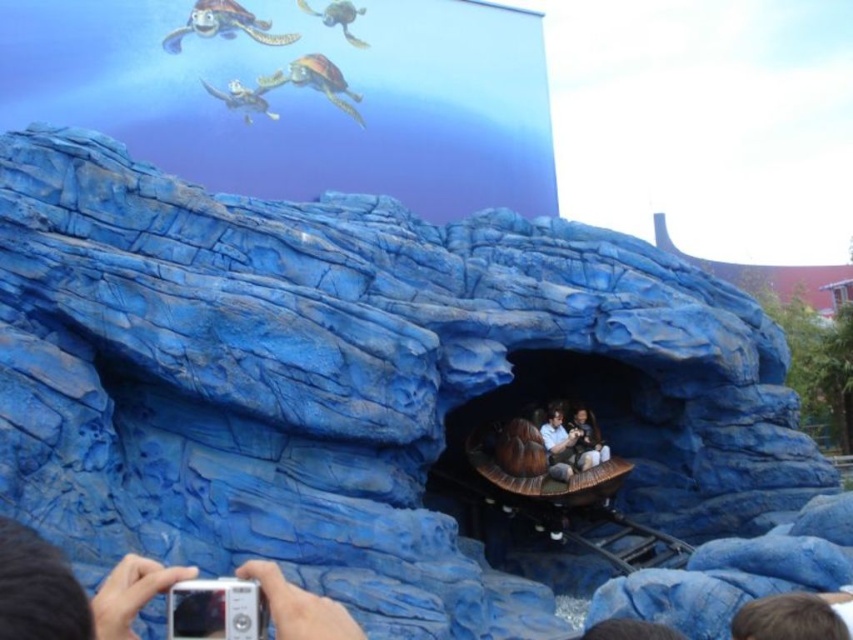
How much distance is there between silver metallic camera at lower left and smooth brown leather jacket at center?

They are 34.35 meters apart.

Between silver metallic camera at lower left and smooth brown leather jacket at center, which one has more height?

silver metallic camera at lower left

Is point (108, 577) behind point (578, 433)?

No.

You are a GUI agent. You are given a task and a screenshot of the screen. Output one action in this format:
    pyautogui.click(x=<x>, y=<y>)
    Task: Click on the silver metallic camera at lower left
    The width and height of the screenshot is (853, 640).
    Given the screenshot: What is the action you would take?
    pyautogui.click(x=70, y=589)

Who is shorter, silver metallic camera at lower left or smooth brown wooden boat at center?

smooth brown wooden boat at center is shorter.

Who is more distant from viewer, (x=115, y=630) or (x=587, y=424)?

Point (x=587, y=424)

This screenshot has height=640, width=853. I want to click on silver metallic camera at lower left, so click(70, 589).

Can you confirm if smooth brown leather jacket at center is smaller than smooth brown wooden boat at center?

Indeed, smooth brown leather jacket at center has a smaller size compared to smooth brown wooden boat at center.

Does point (569, 445) come closer to viewer compared to point (585, 465)?

That is False.

Locate an element on the screen. Image resolution: width=853 pixels, height=640 pixels. smooth brown leather jacket at center is located at coordinates (560, 444).